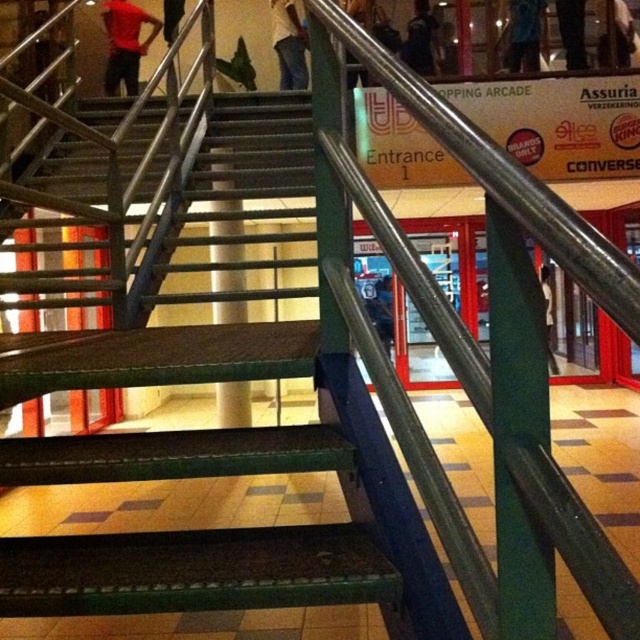
You are a fashion designer observing the scene. You notice a red matte shirt at upper left and jeans at upper center. Which clothing item appears shorter in the image?

The red matte shirt at upper left has a lesser height compared to jeans at upper center, so the red matte shirt at upper left appears shorter.

You are a delivery person carrying a package that is 3 feet long. You need to walk through the shopping arcade while avoiding the blue shirt at upper center and the dark blue backpack at upper center. Can you safely pass between them without hitting the package?

The blue shirt at upper center is 35.39 inches away from the dark blue backpack at upper center. Since 35.39 inches is approximately 2.95 feet, the distance between them is slightly less than the length of your 3 feet package. Therefore, you might not have enough space to pass safely without the package hitting one of them.

You are standing at the bottom of the staircase in the shopping arcade. You see two points marked on the floor in front of you. One is at coordinate point (534, 45) and the other is at point (410, 54). Which point is closer to you?

Point (534, 45) is closer to the camera than point (410, 54), so the point at (534, 45) is closer to you.